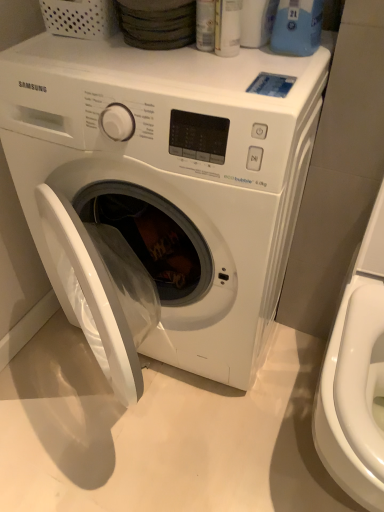
Find the location of `vacant area situated below white glossy washing machine at center (from a real-world perspective)`. vacant area situated below white glossy washing machine at center (from a real-world perspective) is located at coordinates (149, 397).